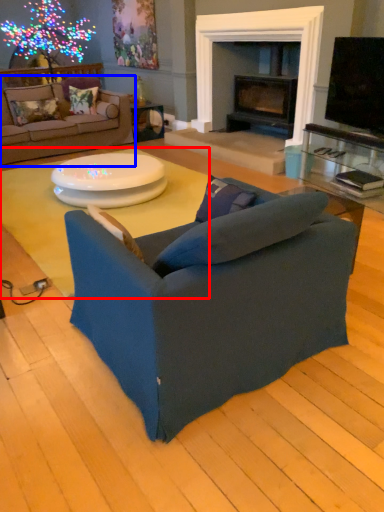
Question: Which of the following is the farthest to the observer, coffee table (highlighted by a red box) or studio couch (highlighted by a blue box)?

Choices:
 (A) coffee table
 (B) studio couch

Answer: (B)